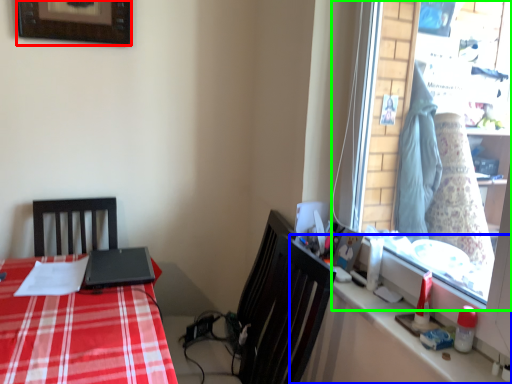
Question: Considering the real-world distances, which object is closest to picture frame (highlighted by a red box)? counter top (highlighted by a blue box) or window (highlighted by a green box).

Choices:
 (A) counter top
 (B) window

Answer: (B)